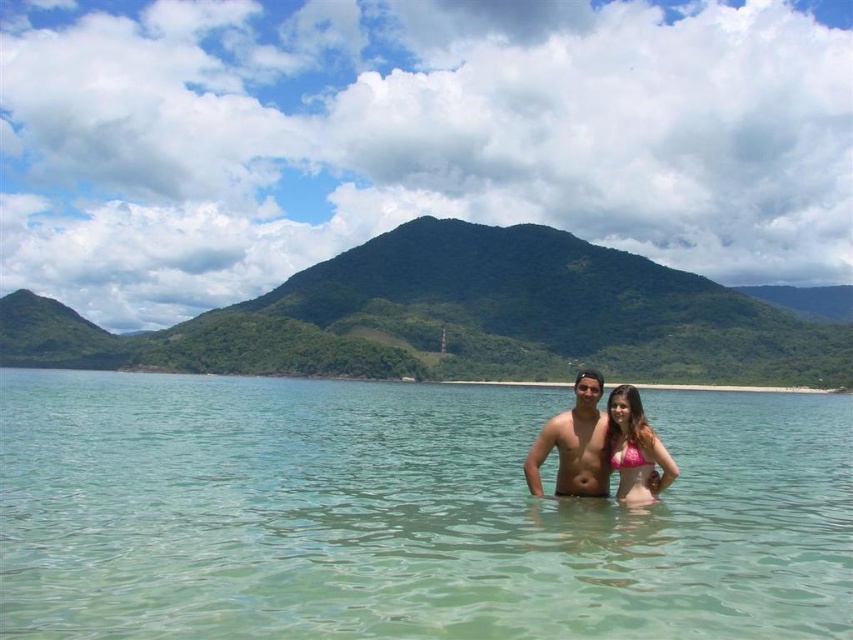
Who is lower down, clear water at center or pink fabric bikini at center?

clear water at center

Is point (94, 506) closer to viewer compared to point (630, 458)?

No, it is behind (630, 458).

This screenshot has height=640, width=853. I want to click on clear water at center, so click(404, 515).

From the picture: Between clear water at center and matte skin torso at center, which one is positioned lower?

clear water at center

Is point (30, 419) positioned after point (581, 385)?

Yes, it is behind point (581, 385).

Locate an element on the screen. The image size is (853, 640). clear water at center is located at coordinates (404, 515).

Does matte skin torso at center have a larger size compared to pink bikini at center?

Indeed, matte skin torso at center has a larger size compared to pink bikini at center.

Where is `matte skin torso at center`? This screenshot has width=853, height=640. matte skin torso at center is located at coordinates (573, 444).

You are a GUI agent. You are given a task and a screenshot of the screen. Output one action in this format:
    pyautogui.click(x=<x>, y=<y>)
    Task: Click on the matte skin torso at center
    This screenshot has width=853, height=640.
    Given the screenshot: What is the action you would take?
    pyautogui.click(x=573, y=444)